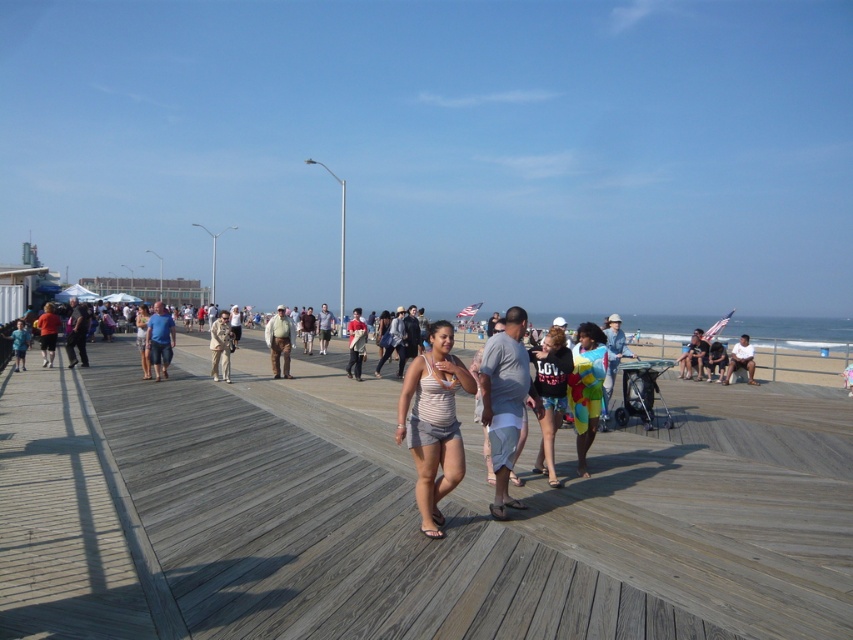
Question: Which of the following is the farthest from the observer?

Choices:
 (A) 22,326
 (B) 737,353
 (C) 614,317

Answer: (A)

Question: In this image, where is multicolored fabric dress at center located relative to light beige uniform at center?

Choices:
 (A) above
 (B) below

Answer: (B)

Question: Which point is closer to the camera?

Choices:
 (A) (749, 372)
 (B) (561, 349)

Answer: (B)

Question: Does denim jacket at center have a greater width compared to light brown leather jacket at center?

Choices:
 (A) no
 (B) yes

Answer: (B)

Question: Which point is closer to the camera?

Choices:
 (A) brown leather pants at center
 (B) striped tank top at center
 (C) wooden at center
 (D) matte black sweatshirt at center

Answer: (C)

Question: Does light beige uniform at center have a larger size compared to matte gray shirt at lower left?

Choices:
 (A) no
 (B) yes

Answer: (B)